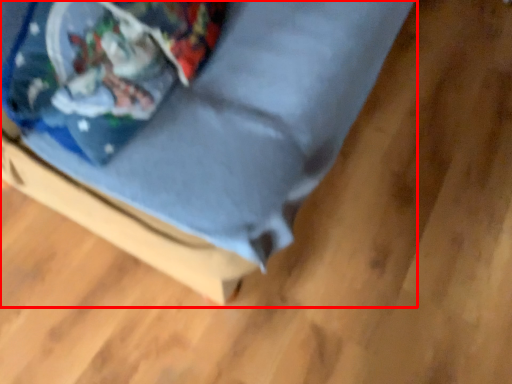
Question: Observing the image, what is the correct spatial positioning of furniture (annotated by the red box) in reference to wrapping paper?

Choices:
 (A) left
 (B) right

Answer: (B)